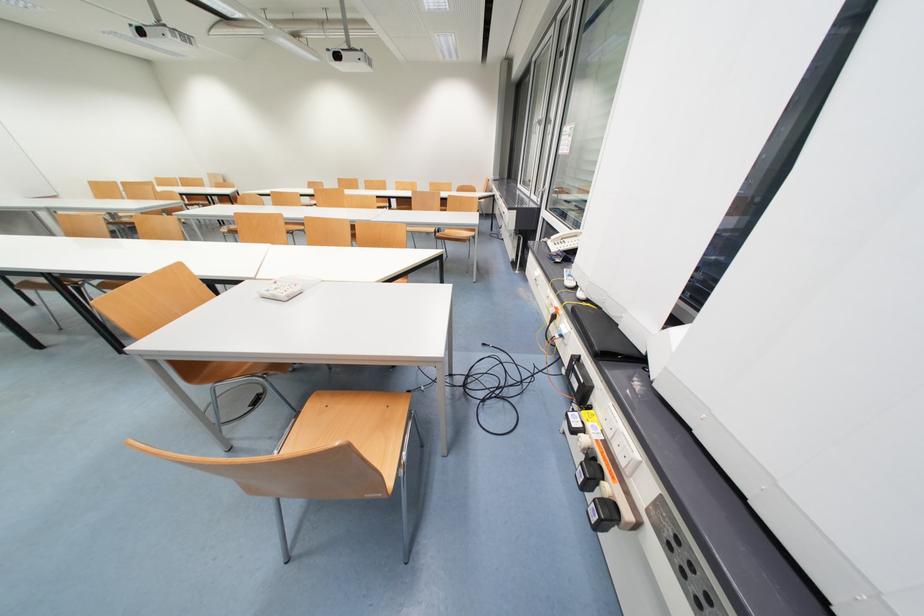
The width and height of the screenshot is (924, 616). Identify the location of telephone handset. click(x=283, y=289).